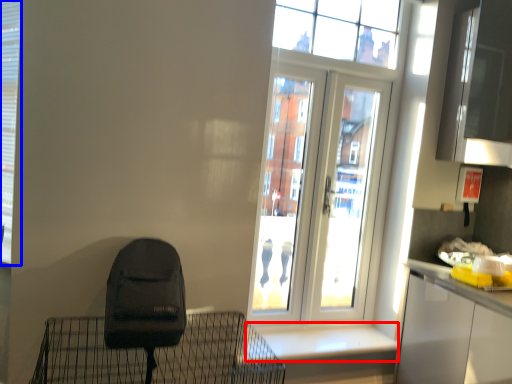
Question: Which object is further to the camera taking this photo, window sill (highlighted by a red box) or shutter (highlighted by a blue box)?

Choices:
 (A) window sill
 (B) shutter

Answer: (A)